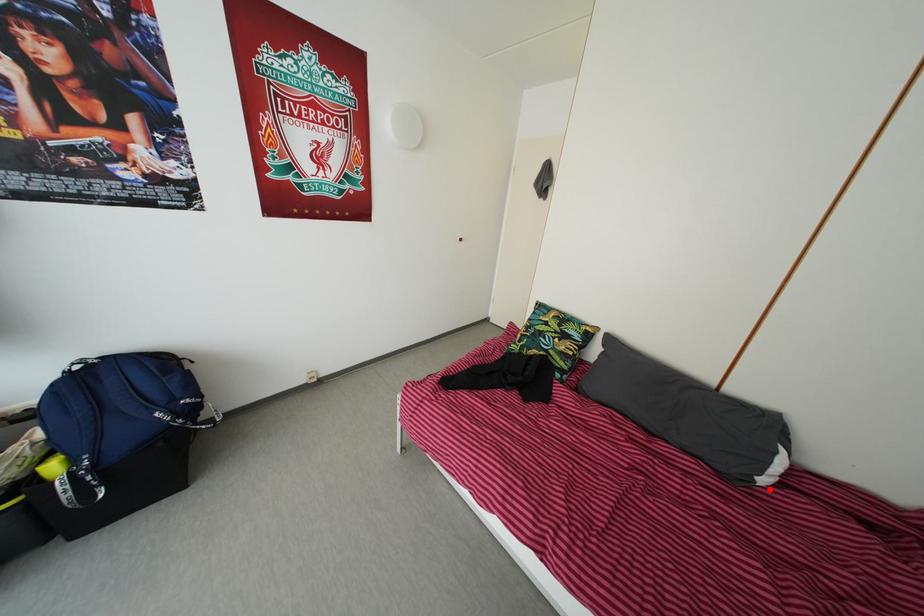
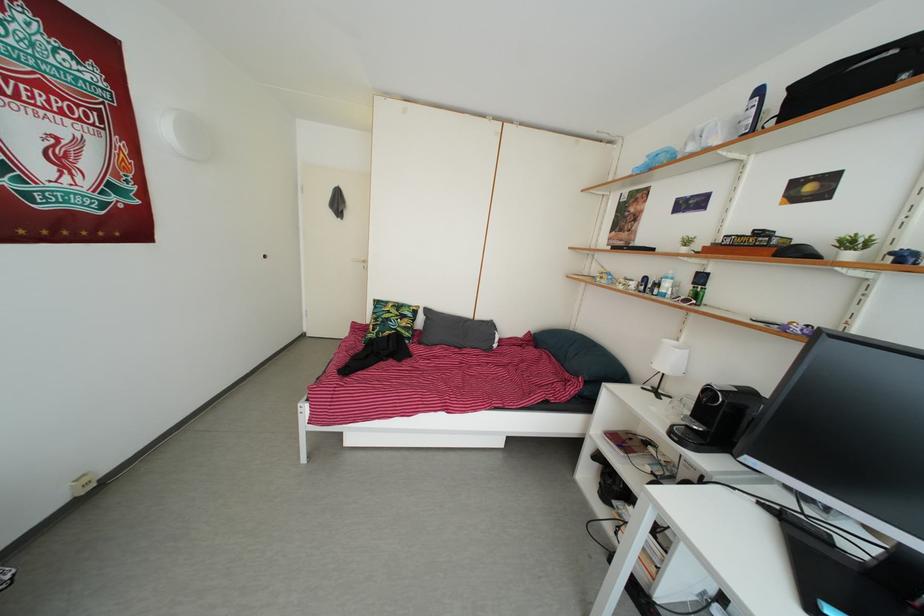
Question: I am providing you with two images of the same scene from different viewpoints. A red point is shown in image1. For the corresponding object point in image2, is it positioned nearer or farther from the camera?

Choices:
 (A) Nearer
 (B) Farther

Answer: (B)